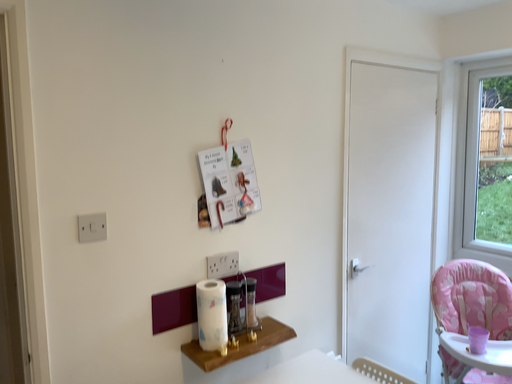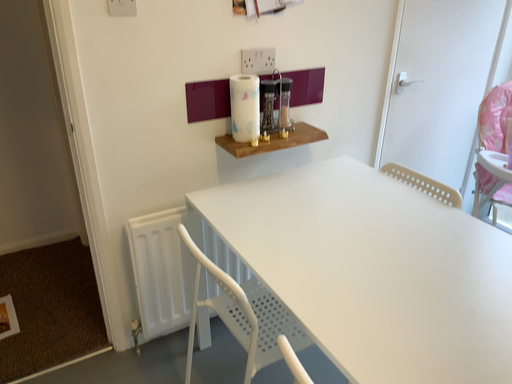
Question: How did the camera likely rotate when shooting the video?

Choices:
 (A) rotated upward
 (B) rotated downward

Answer: (B)